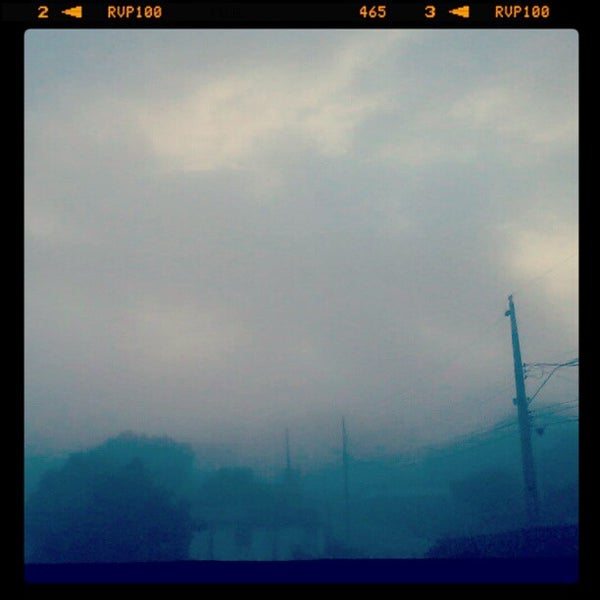
In order to click on cable in this screenshot , I will do `click(549, 362)`.